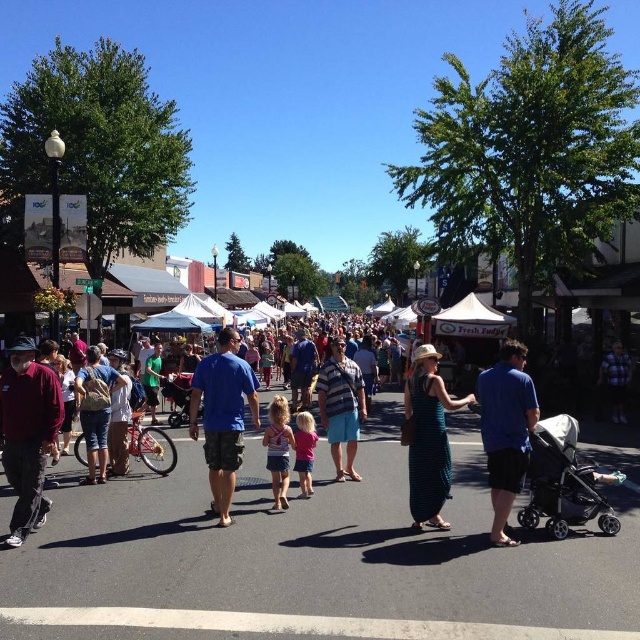
Image resolution: width=640 pixels, height=640 pixels. What do you see at coordinates (221, 417) in the screenshot?
I see `blue cotton shirt at center` at bounding box center [221, 417].

Locate an element on the screen. This screenshot has height=640, width=640. blue cotton shirt at center is located at coordinates (221, 417).

Between point (240, 452) and point (301, 468), which one is positioned in front?

Point (240, 452) is more forward.

Image resolution: width=640 pixels, height=640 pixels. I want to click on blue cotton shirt at center, so click(x=221, y=417).

Between point (13, 342) and point (420, 419), which one is positioned behind?

The point (420, 419) is more distant.

Between maroon fabric shirt at left and teal woven dress at center, which one is positioned higher?

teal woven dress at center is above.

Locate an element on the screen. The image size is (640, 640). maroon fabric shirt at left is located at coordinates (28, 433).

At what (x,y) coordinates should I click in order to perform the action: click on maroon fabric shirt at left. Please return your answer as a coordinate pair (x, y). Looking at the image, I should click on (28, 433).

Does blue cotton shirt at center appear over light pink fabric dress at center?

Correct, blue cotton shirt at center is located above light pink fabric dress at center.

Does point (241, 413) come closer to viewer compared to point (284, 448)?

Yes.

I want to click on blue cotton shirt at center, so click(221, 417).